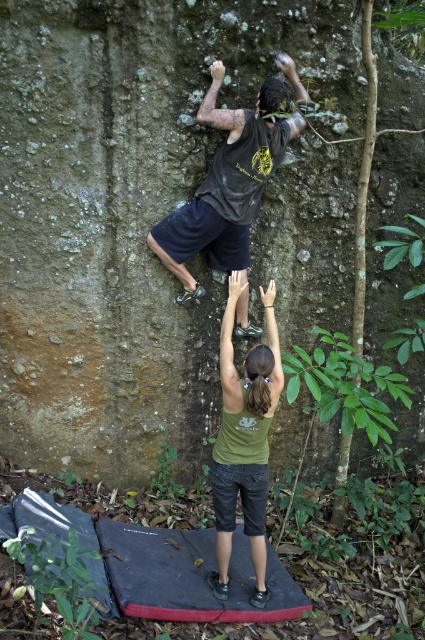
Question: Is the position of black matte shirt at upper center more distant than that of green matte shirt at center?

Choices:
 (A) no
 (B) yes

Answer: (B)

Question: Which point appears closest to the camera in this image?

Choices:
 (A) (271, 108)
 (B) (265, 308)

Answer: (A)

Question: Which point is closer to the camera taking this photo?

Choices:
 (A) (181, 278)
 (B) (238, 445)

Answer: (B)

Question: Considering the relative positions of black matte shirt at upper center and green matte shirt at center in the image provided, where is black matte shirt at upper center located with respect to green matte shirt at center?

Choices:
 (A) left
 (B) right

Answer: (A)

Question: Can you confirm if black matte shirt at upper center is positioned to the left of green matte shirt at center?

Choices:
 (A) no
 (B) yes

Answer: (B)